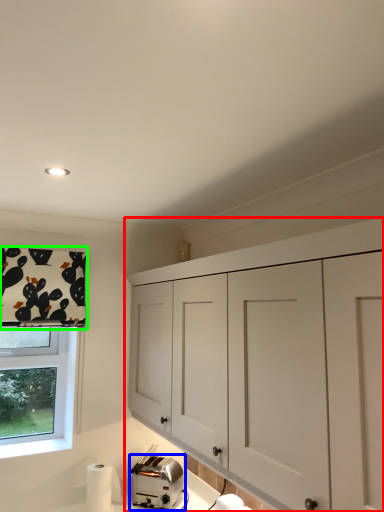
Question: Which object is the farthest from cabinetry (highlighted by a red box)? Choose among these: toaster (highlighted by a blue box) or curtain (highlighted by a green box).

Choices:
 (A) toaster
 (B) curtain

Answer: (B)